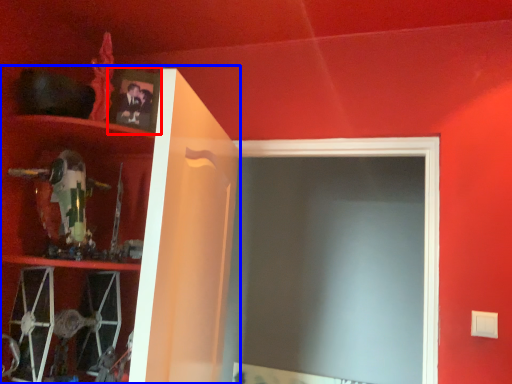
Question: Which object is further to the camera taking this photo, picture frame (highlighted by a red box) or cabinet (highlighted by a blue box)?

Choices:
 (A) picture frame
 (B) cabinet

Answer: (A)